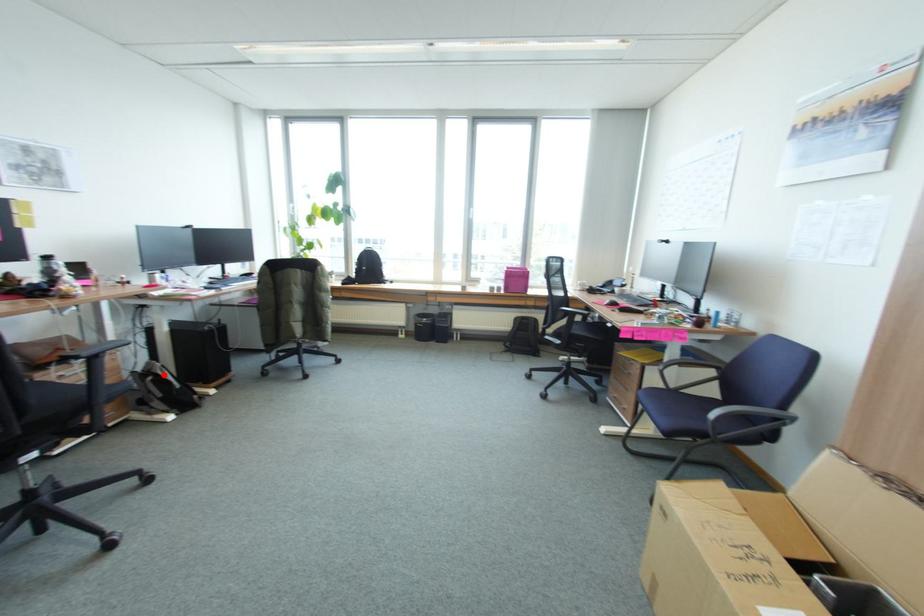
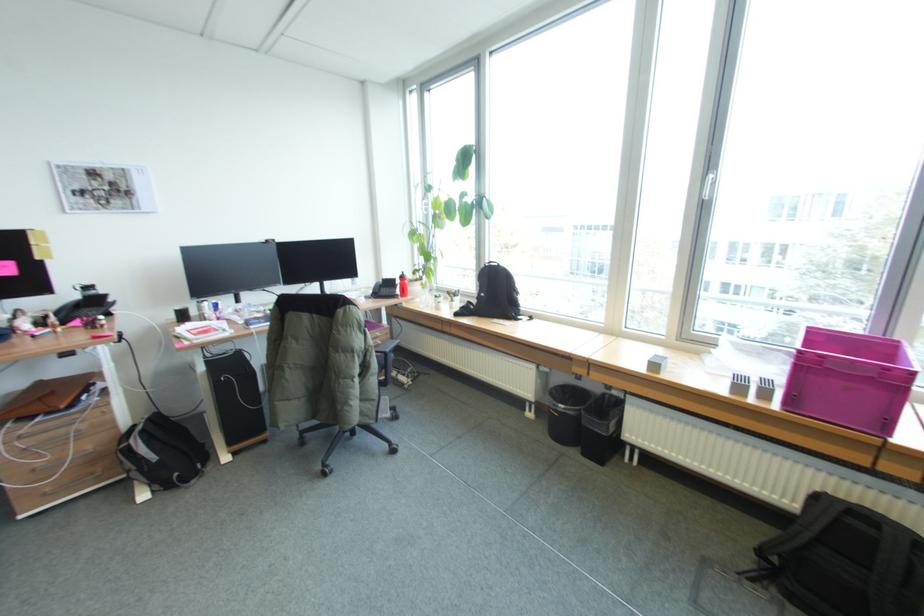
Question: I am providing you with two images of the same scene from different viewpoints. A red point is marked on the first image. Is the red point's position out of view in image 2?

Choices:
 (A) Yes
 (B) No

Answer: (B)